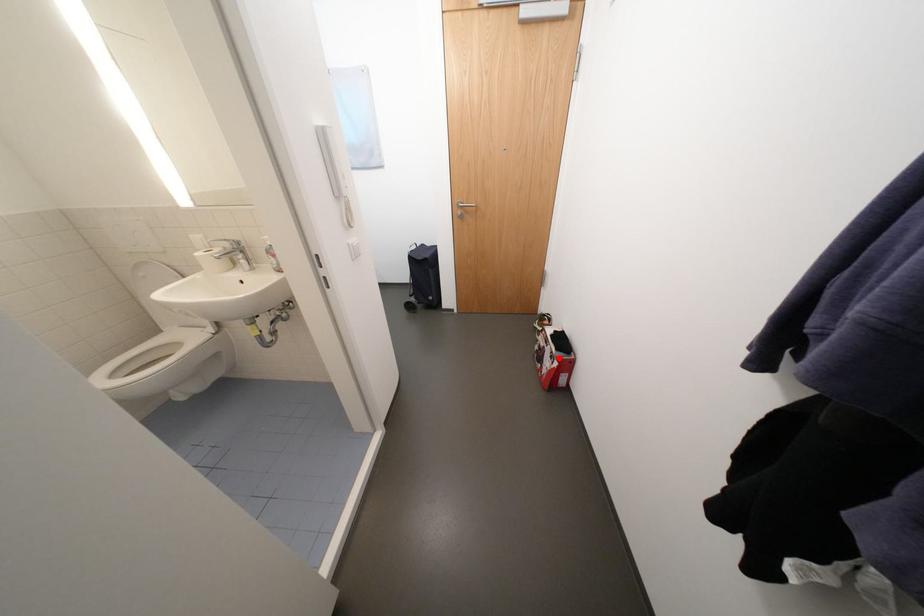
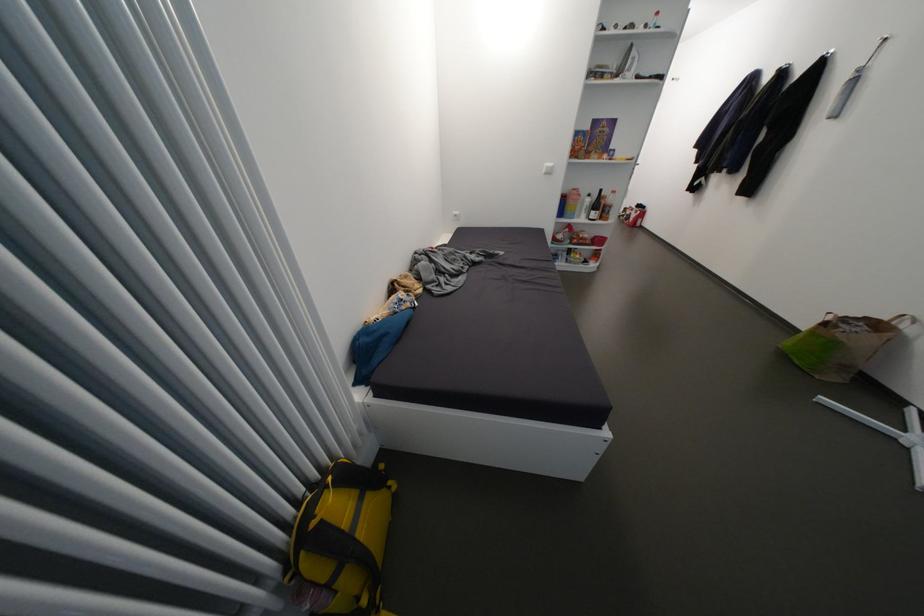
Find the pixel in the second image that matches the highlighted location in the first image.

(642, 214)